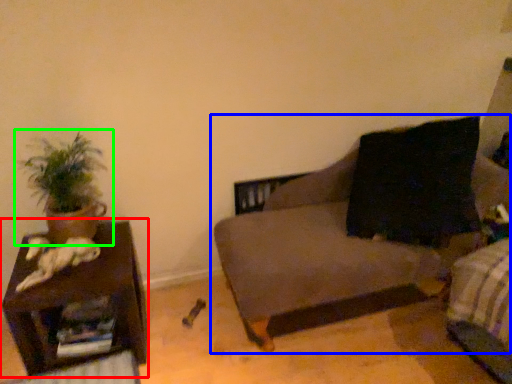
Question: Which is nearer to the furniture (highlighted by a red box)? studio couch (highlighted by a blue box) or houseplant (highlighted by a green box).

Choices:
 (A) studio couch
 (B) houseplant

Answer: (B)